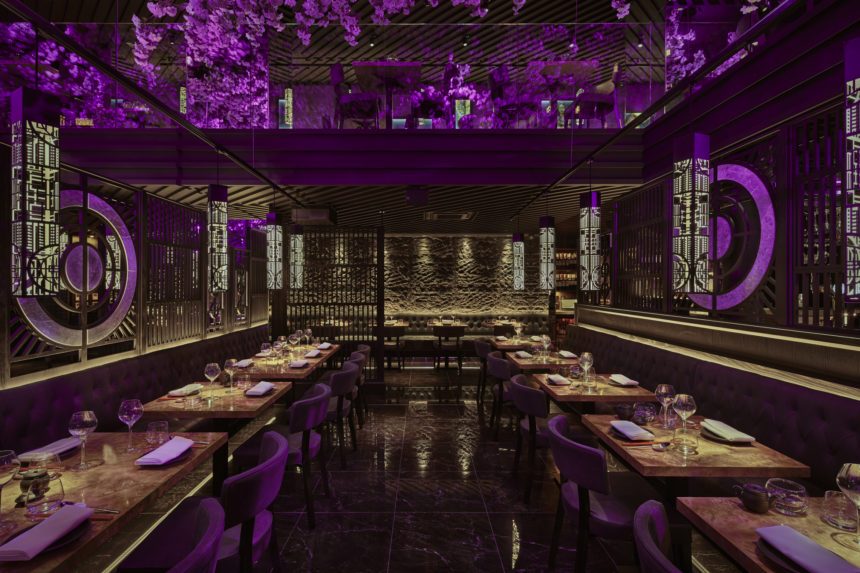
In order to click on floor in this screenshot , I will do `click(428, 442)`.